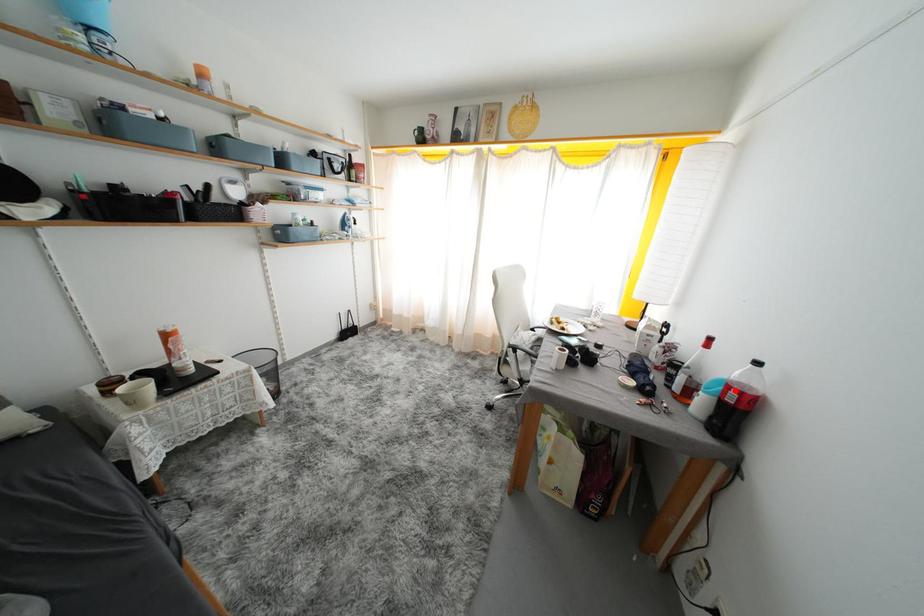
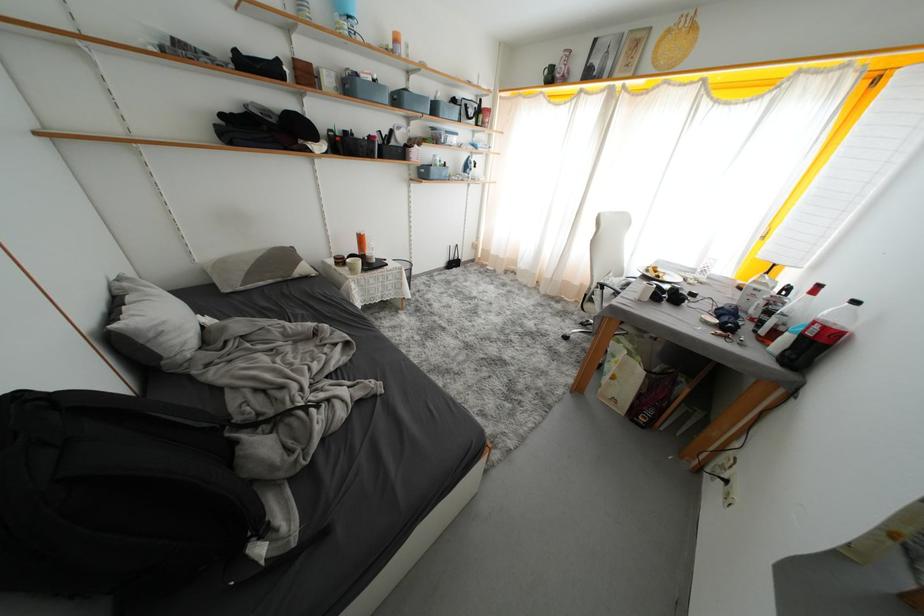
Locate, in the second image, the point that corresponds to the highlighted location in the first image.

(821, 328)